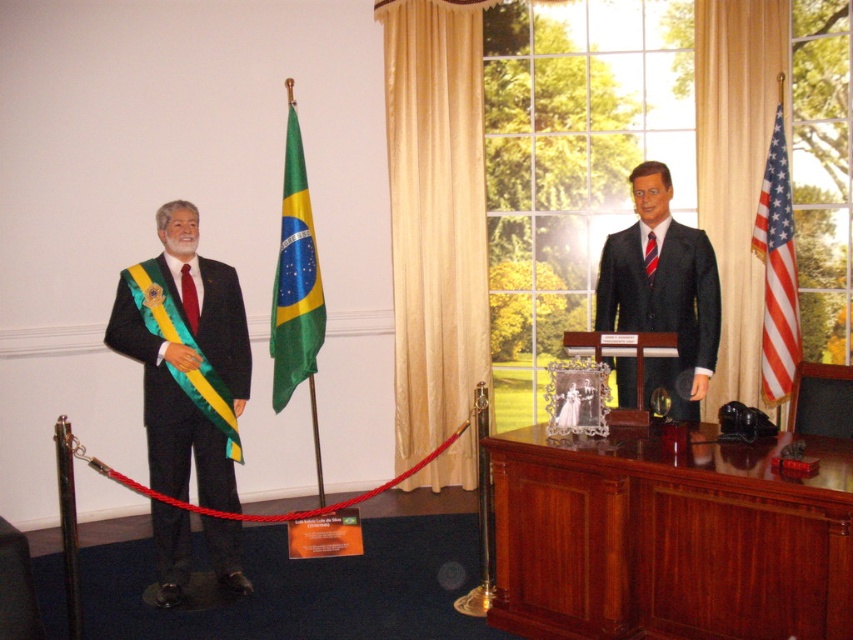
Question: Among these points, which one is nearest to the camera?

Choices:
 (A) (287, 339)
 (B) (759, 193)

Answer: (B)

Question: In this image, where is shiny dark suit at center located relative to american flag at right?

Choices:
 (A) left
 (B) right

Answer: (A)

Question: Which is nearer to the striped fabric tie at right?

Choices:
 (A) american flag at right
 (B) green satin flag at center

Answer: (A)

Question: Is matte black suit at left thinner than green satin flag at center?

Choices:
 (A) no
 (B) yes

Answer: (A)

Question: Which of the following is the farthest from the observer?

Choices:
 (A) (798, 561)
 (B) (181, 273)
 (C) (233, 561)
 (D) (621, 392)

Answer: (D)

Question: Is green satin flag at center behind striped fabric tie at right?

Choices:
 (A) no
 (B) yes

Answer: (B)